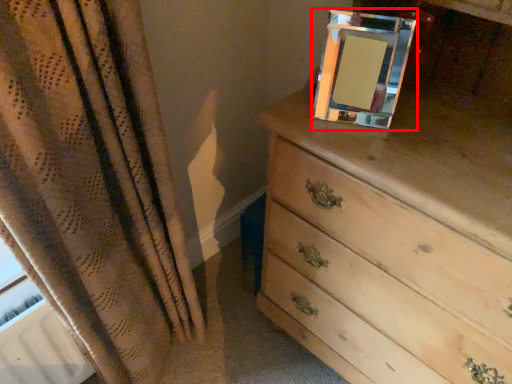
Question: Observing the image, what is the correct spatial positioning of picture frame (annotated by the red box) in reference to chest of drawers?

Choices:
 (A) left
 (B) right

Answer: (A)